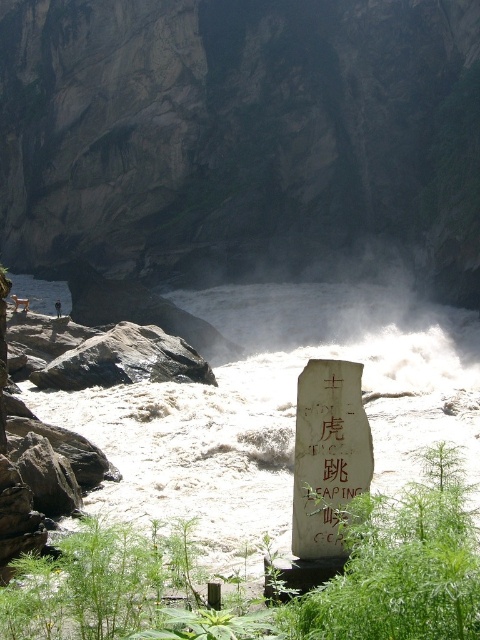
What is the exact location of the white frothy water at center in the image?

The white frothy water at center is located at point (x=347, y=330).

Based on the scene description, can you determine the relative position of the white frothy water at center and the gray rock at left? Please explain using the given information.

The white frothy water at center is above the gray rock at left according to the description provided.

From the picture: You are standing at the edge of the canyon overlooking the river and want to throw a small pebble into the white frothy water at center. Based on your knowledge of physics and the distance provided, will the pebble reach the water if you throw it horizontally with a speed of 10 m per second?

The white frothy water at center is 47.27 meters away from the viewer. To determine if the pebble will reach, we calculate the time it takes to fall vertically. Assuming the throw is horizontal, the vertical motion is free fall. The vertical distance fallen is given by h equals 0.5 times gravity times time squared. However, without knowing the vertical drop height from the canyon edge to the water level, we cannot compute the required horizontal distance. Thus, insufficient information is provided to answer